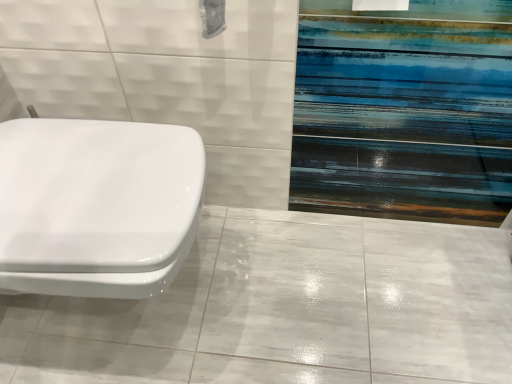
Locate an element on the screen. empty space that is ontop of white glossy tile at lower left (from a real-world perspective) is located at coordinates (283, 305).